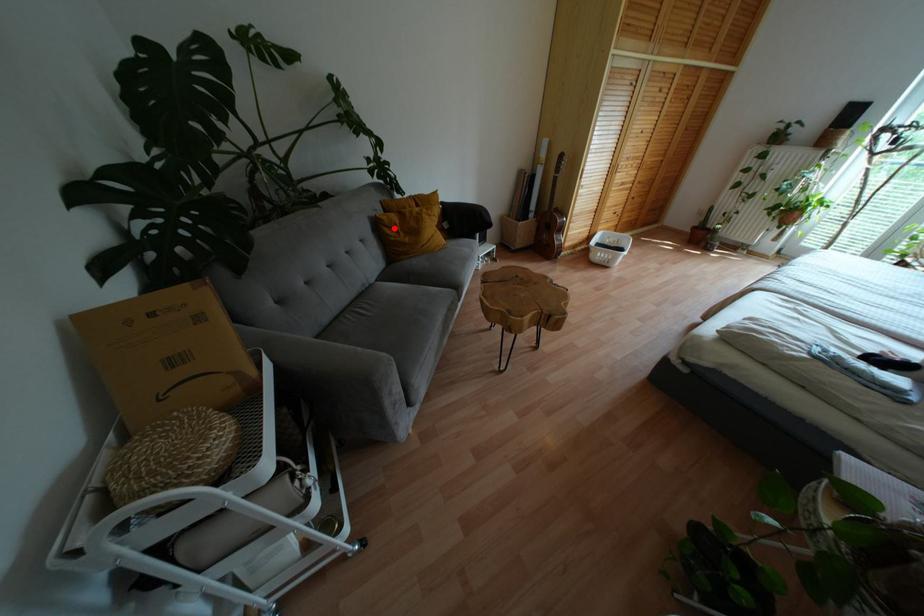
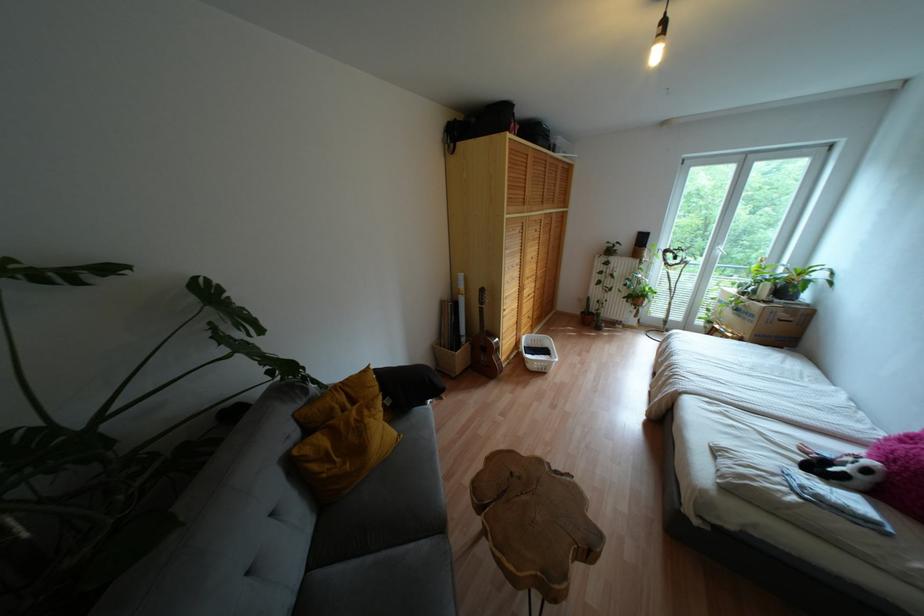
The point at the highlighted location is marked in the first image. Where is the corresponding point in the second image?

(325, 458)